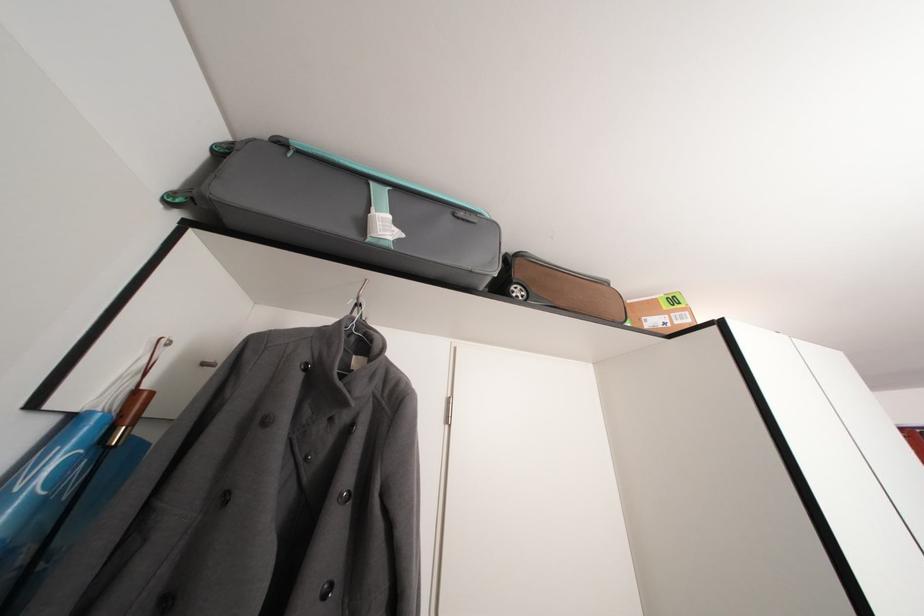
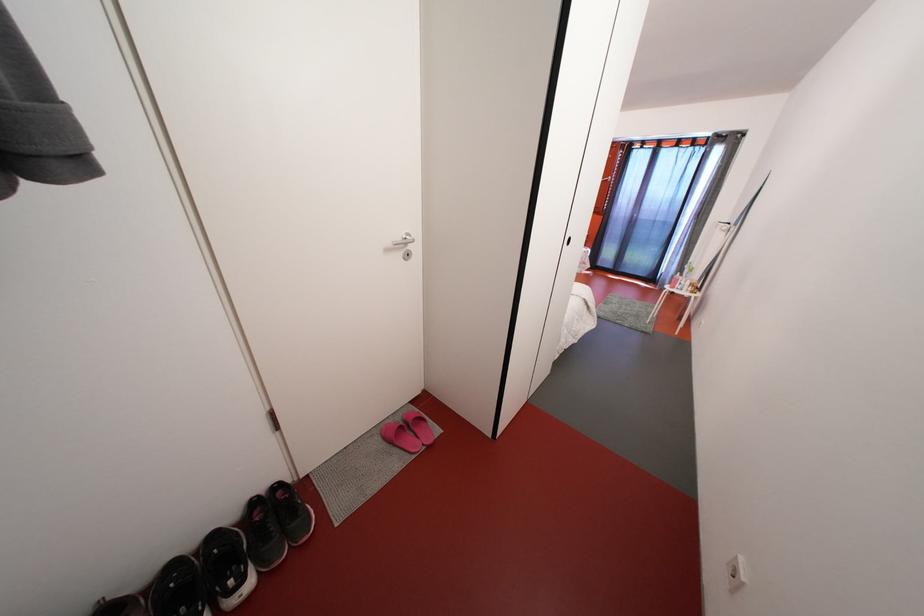
In the scene shown: How did the camera likely rotate?

The camera rotated toward right-down.